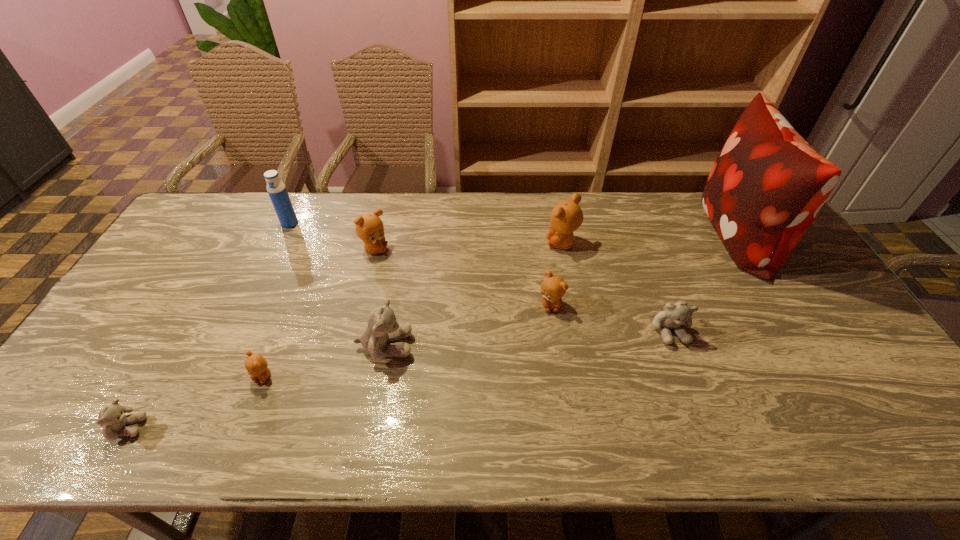
Locate an element on the screen. the third object from left to right is located at coordinates (256, 365).

Identify the location of the smallest brown teddy bear. This screenshot has width=960, height=540. (256, 365).

Locate an element on the screen. This screenshot has width=960, height=540. the nearest teddy bear is located at coordinates (112, 417).

I want to click on the leftmost object, so click(112, 417).

I want to click on vacant area situated on the front-facing side of the cushion, so click(604, 234).

Find the location of a particular element. The width and height of the screenshot is (960, 540). free space located 0.380m on the front-facing side of the cushion is located at coordinates pyautogui.click(x=583, y=234).

Find the location of a particular element. free space located 0.170m on the front-facing side of the cushion is located at coordinates (646, 234).

This screenshot has width=960, height=540. Identify the location of vacant space situated on the right of the water bottle. (377, 224).

Find the location of a particular element. This screenshot has width=960, height=540. vacant space situated 0.280m on the face of the tallest teddy bear is located at coordinates (460, 244).

This screenshot has height=540, width=960. In order to click on blank space located on the face of the tallest teddy bear in this screenshot , I will do `click(450, 244)`.